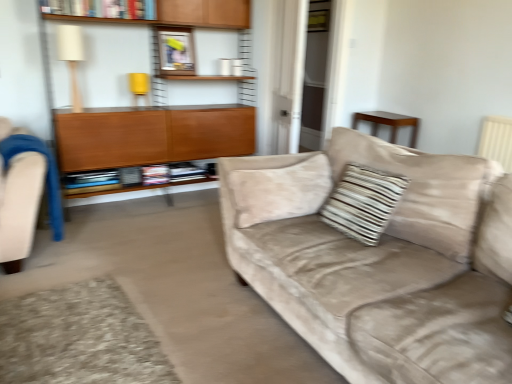
Question: From the image's perspective, does suede beige couch at center appear lower than striped fabric pillow at center?

Choices:
 (A) yes
 (B) no

Answer: (A)

Question: Is suede beige couch at center aimed at striped fabric pillow at center?

Choices:
 (A) yes
 (B) no

Answer: (A)

Question: Is suede beige couch at center thinner than striped fabric pillow at center?

Choices:
 (A) no
 (B) yes

Answer: (A)

Question: Does suede beige couch at center appear on the left side of striped fabric pillow at center?

Choices:
 (A) no
 (B) yes

Answer: (A)

Question: Is suede beige couch at center touching striped fabric pillow at center?

Choices:
 (A) no
 (B) yes

Answer: (A)

Question: Which is correct: wooden cabinet at left is inside hardcover book at upper center, which appears as the first book when viewed from the top, or outside of it?

Choices:
 (A) outside
 (B) inside

Answer: (A)

Question: Is wooden cabinet at left wider or thinner than hardcover book at upper center, positioned as the 2th book in bottom-to-top order?

Choices:
 (A) wide
 (B) thin

Answer: (A)

Question: From a real-world perspective, is wooden cabinet at left physically located above or below hardcover book at upper center, positioned as the 2th book in bottom-to-top order?

Choices:
 (A) above
 (B) below

Answer: (B)

Question: Considering the positions of wooden cabinet at left and hardcover book at upper center, positioned as the 2th book in bottom-to-top order, in the image, is wooden cabinet at left bigger or smaller than hardcover book at upper center, positioned as the 2th book in bottom-to-top order,?

Choices:
 (A) small
 (B) big

Answer: (B)

Question: From their relative heights in the image, would you say metallic silver picture frame at upper center is taller or shorter than wooden cabinet at left?

Choices:
 (A) tall
 (B) short

Answer: (B)

Question: Is metallic silver picture frame at upper center bigger or smaller than wooden cabinet at left?

Choices:
 (A) small
 (B) big

Answer: (A)

Question: From the image's perspective, is metallic silver picture frame at upper center above or below wooden cabinet at left?

Choices:
 (A) below
 (B) above

Answer: (B)

Question: Do you think metallic silver picture frame at upper center is within wooden cabinet at left, or outside of it?

Choices:
 (A) inside
 (B) outside

Answer: (A)

Question: Considering their positions, is wooden cabinet at left located in front of or behind striped fabric pillow at center?

Choices:
 (A) front
 (B) behind

Answer: (B)

Question: In terms of size, does wooden cabinet at left appear bigger or smaller than striped fabric pillow at center?

Choices:
 (A) big
 (B) small

Answer: (A)